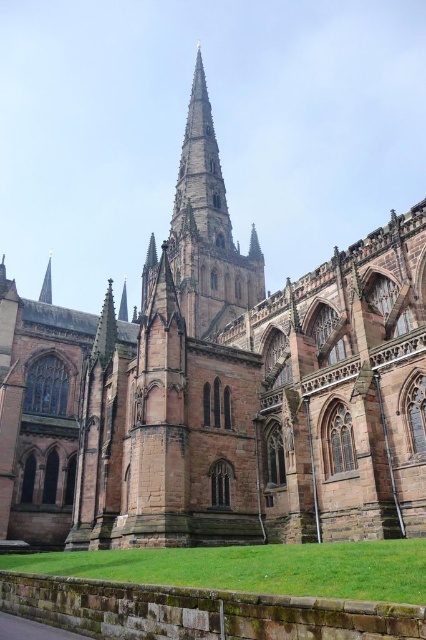
Question: Does brown stone spire at center appear over smooth stone spire at upper center?

Choices:
 (A) yes
 (B) no

Answer: (A)

Question: Which of the following is the farthest from the observer?

Choices:
 (A) smooth stone spire at upper center
 (B) brown stone spire at center

Answer: (A)

Question: Which of the following is the farthest from the observer?

Choices:
 (A) (204, 131)
 (B) (51, 289)

Answer: (B)

Question: Which point is farther from the camera taking this photo?

Choices:
 (A) (48, 260)
 (B) (184, 150)

Answer: (A)

Question: Does brown stone spire at center appear on the left side of smooth stone spire at upper center?

Choices:
 (A) yes
 (B) no

Answer: (B)

Question: Considering the relative positions of brown stone spire at center and smooth stone spire at upper center in the image provided, where is brown stone spire at center located with respect to smooth stone spire at upper center?

Choices:
 (A) above
 (B) below

Answer: (A)